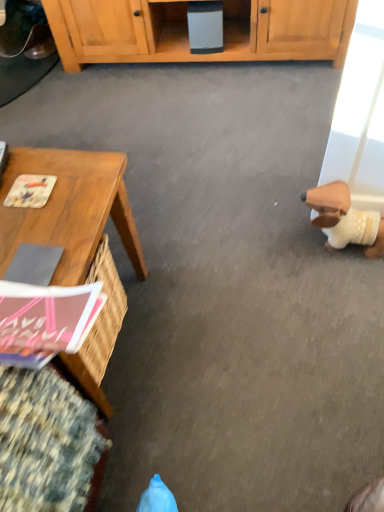
Find the location of a particular element. The height and width of the screenshot is (512, 384). vacant region under brown plush toy at right (from a real-world perspective) is located at coordinates (341, 246).